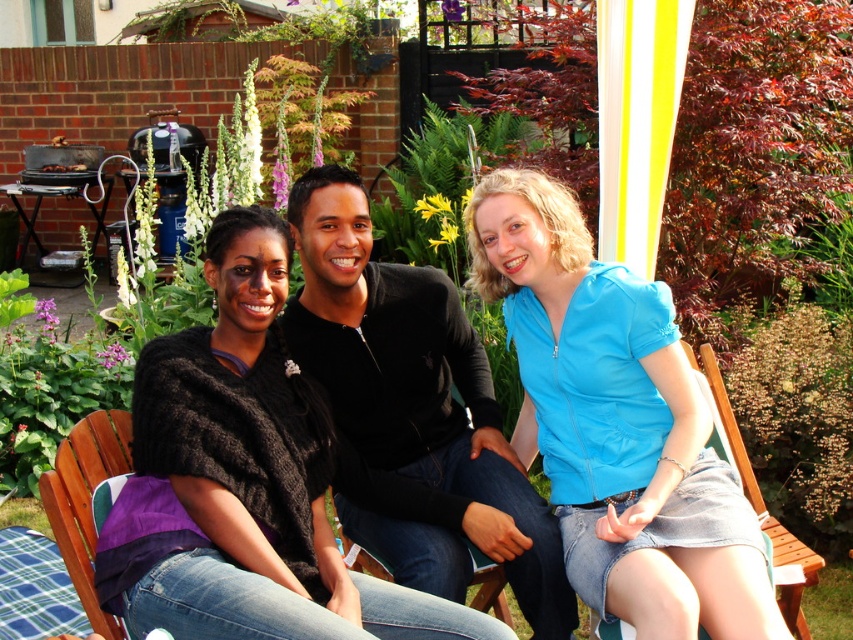
Describe the element at coordinates (616, 424) in the screenshot. The height and width of the screenshot is (640, 853). I see `blue zip-up hoodie at center` at that location.

Does blue zip-up hoodie at center appear on the left side of black matte sweater at center?

In fact, blue zip-up hoodie at center is to the right of black matte sweater at center.

Between point (527, 388) and point (431, 346), which one is positioned behind?

Point (431, 346)

This screenshot has width=853, height=640. Identify the location of blue zip-up hoodie at center. (616, 424).

Is blue zip-up hoodie at center to the left of wooden chair at lower right from the viewer's perspective?

Correct, you'll find blue zip-up hoodie at center to the left of wooden chair at lower right.

Based on the photo, which is above, blue zip-up hoodie at center or wooden chair at lower right?

Positioned higher is blue zip-up hoodie at center.

Identify the location of blue zip-up hoodie at center. The image size is (853, 640). (616, 424).

Does black matte sweater at center appear over purple fabric chair at lower left?

Yes, black matte sweater at center is above purple fabric chair at lower left.

Between black matte sweater at center and purple fabric chair at lower left, which one is positioned higher?

Positioned higher is black matte sweater at center.

The height and width of the screenshot is (640, 853). What do you see at coordinates (413, 413) in the screenshot? I see `black matte sweater at center` at bounding box center [413, 413].

Find the location of a particular element. black matte sweater at center is located at coordinates (413, 413).